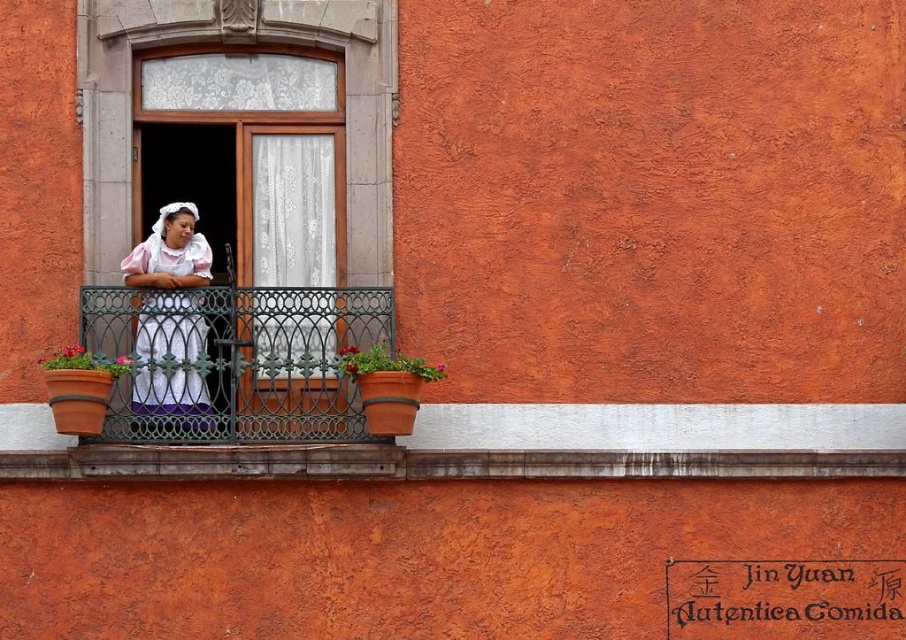
Between white cotton dress at center and terracotta clay pot at left, which one is positioned lower?

terracotta clay pot at left is lower down.

How distant is white cotton dress at center from terracotta clay pot at left?

white cotton dress at center is 5.03 meters from terracotta clay pot at left.

Which is in front, point (158, 356) or point (63, 362)?

Point (63, 362)

This screenshot has width=906, height=640. What are the coordinates of `white cotton dress at center` in the screenshot? It's located at (170, 285).

Which is more to the right, green wrought iron balcony at center or terracotta clay pot at left?

From the viewer's perspective, green wrought iron balcony at center appears more on the right side.

Does green wrought iron balcony at center come in front of terracotta clay pot at left?

No, it is behind terracotta clay pot at left.

Who is more forward, (268, 323) or (76, 387)?

Point (76, 387) is in front.

Where is `green wrought iron balcony at center`? green wrought iron balcony at center is located at coordinates (234, 360).

Does wooden window frame at center come behind green wrought iron balcony at center?

No, wooden window frame at center is closer to the viewer.

I want to click on wooden window frame at center, so click(257, 180).